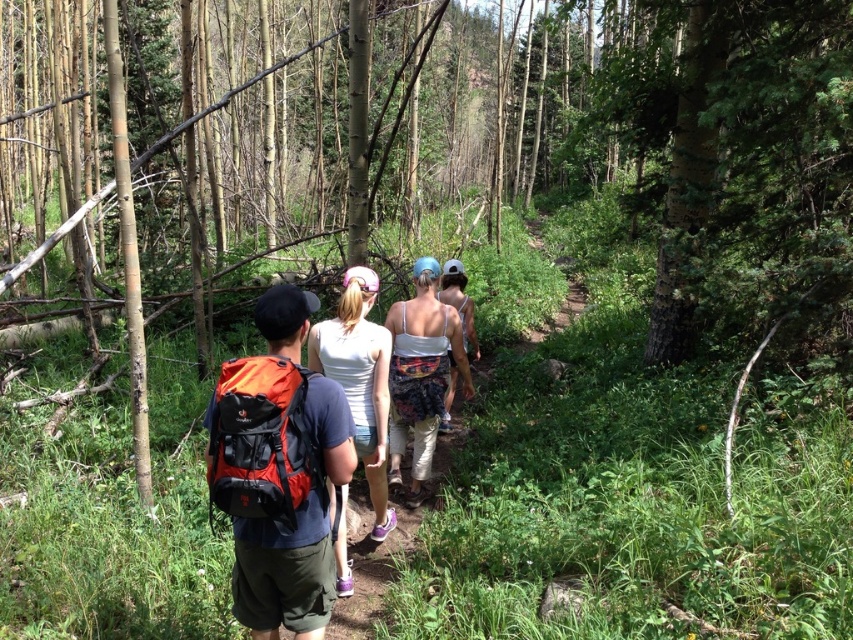
You are a photographer trying to capture the group of hikers. You notice two white clothing items at the center of the image. Which one is closer to the camera, the white fabric tank top at center or the white floral dress at center?

The white fabric tank top at center is closer to the camera because it is in front of the white floral dress at center.

You are a photographer positioned at the back of the group. You want to take a photo of the orange fabric backpack at center and the white floral dress at center without any obstruction. Which object should you focus on first to ensure both are in frame?

The orange fabric backpack at center is not as tall as the white floral dress at center, so you should focus on the white floral dress at center first to ensure both are in frame.